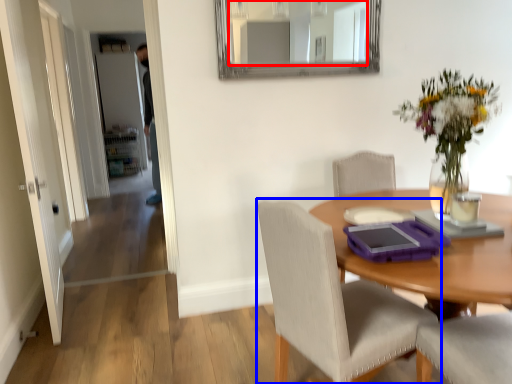
Question: Which object is closer to the camera taking this photo, mirror (highlighted by a red box) or chair (highlighted by a blue box)?

Choices:
 (A) mirror
 (B) chair

Answer: (B)